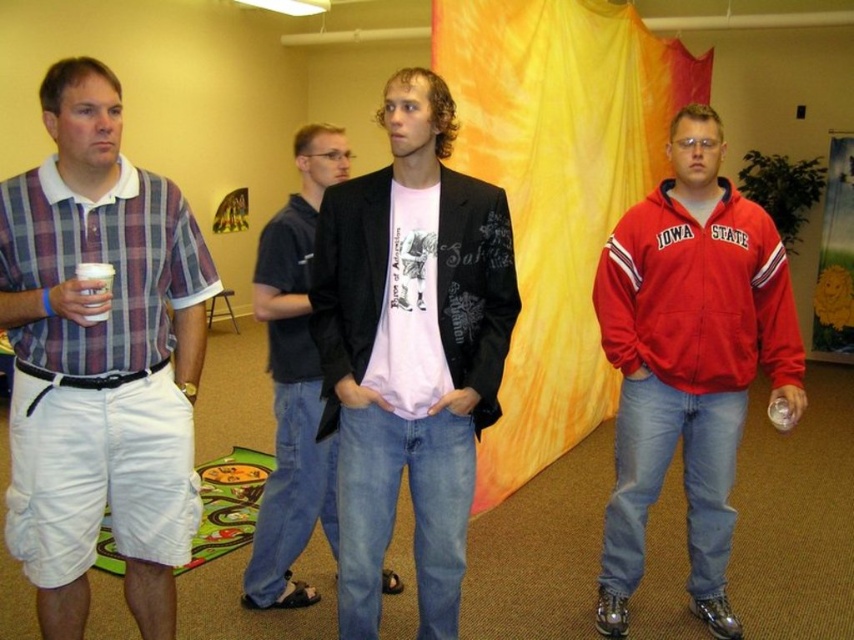
Question: Which of these objects is positioned farthest from the red fleece jacket at right?

Choices:
 (A) matte black jacket at center
 (B) pink matte t-shirt at center
 (C) white paper cup at left

Answer: (C)

Question: Does pink matte t-shirt at center have a larger size compared to white paper cup at left?

Choices:
 (A) no
 (B) yes

Answer: (B)

Question: From the image, what is the correct spatial relationship of plaid cotton shirt at left in relation to red matte jacket at center?

Choices:
 (A) left
 (B) right

Answer: (A)

Question: Which point is closer to the camera taking this photo?

Choices:
 (A) (455, 186)
 (B) (176, 259)
 (C) (681, 436)
 (D) (458, 259)

Answer: (D)

Question: Which of the following is the farthest from the observer?

Choices:
 (A) matte black jacket at center
 (B) red matte jacket at center

Answer: (A)

Question: Is red fleece jacket at right in front of white paper cup at left?

Choices:
 (A) no
 (B) yes

Answer: (A)